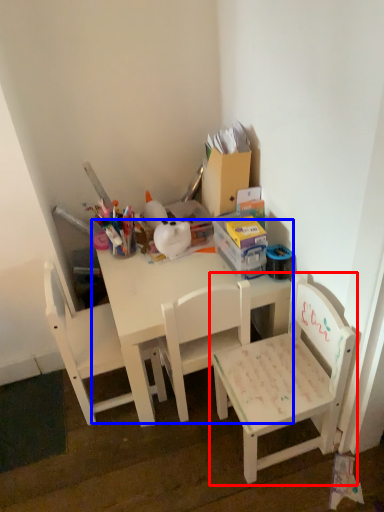
Question: Which of the following is the farthest to the observer, chair (highlighted by a red box) or table (highlighted by a blue box)?

Choices:
 (A) chair
 (B) table

Answer: (B)